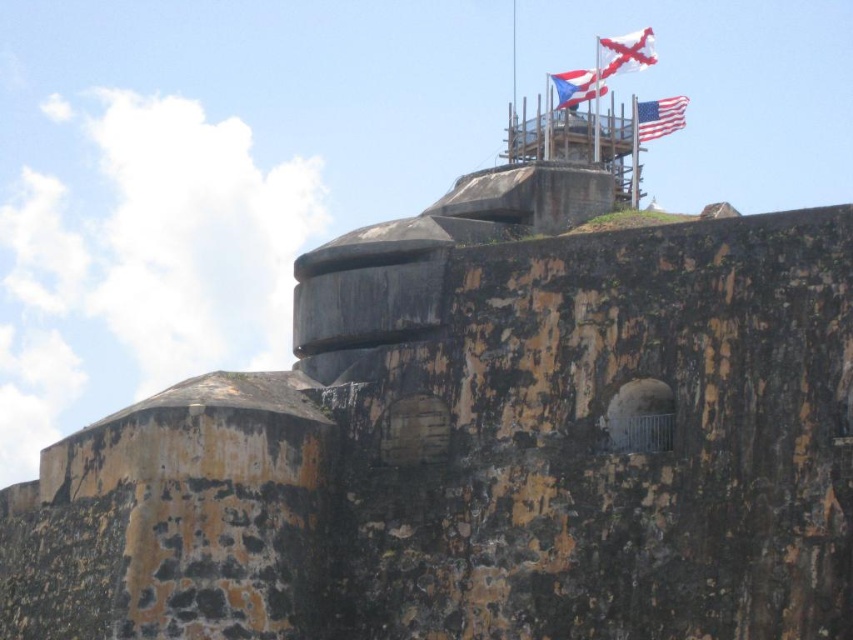
You are standing at the base of the historic stone fortification and want to locate the matte american flag at upper right. Based on the fortification structure, can you estimate its approximate 2D coordinates on the structure?

The matte american flag at upper right is located at the 2D coordinates of point (659, 116) on the structure.

You are standing at the base of the historic stone fortification and want to estimate how far the matte american flag at upper right is from your current position. Based on the scene, can you determine the approximate distance?

The matte american flag at upper right is approximately 323.68 feet away from the viewer.